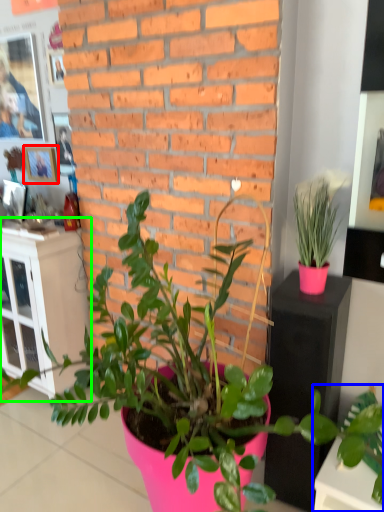
Question: Based on their relative distances, which object is farther from picture frame (highlighted by a red box)? Choose from houseplant (highlighted by a blue box) and file cabinet (highlighted by a green box).

Choices:
 (A) houseplant
 (B) file cabinet

Answer: (A)